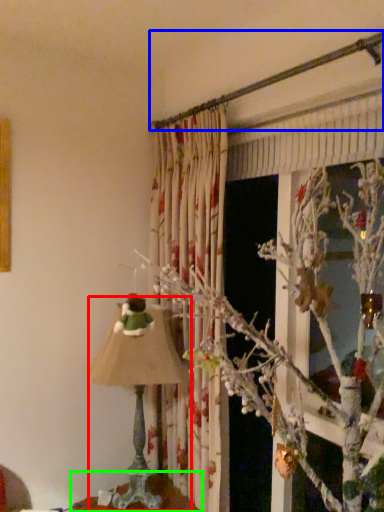
Question: Based on their relative distances, which object is nearer to lamp (highlighted by a red box)? Choose from branch (highlighted by a blue box) and furniture (highlighted by a green box).

Choices:
 (A) branch
 (B) furniture

Answer: (B)